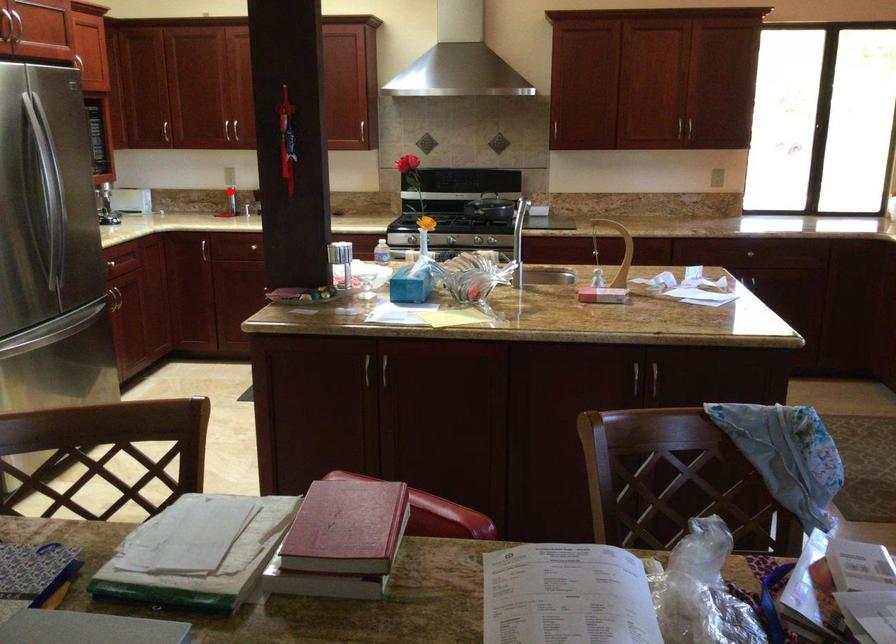
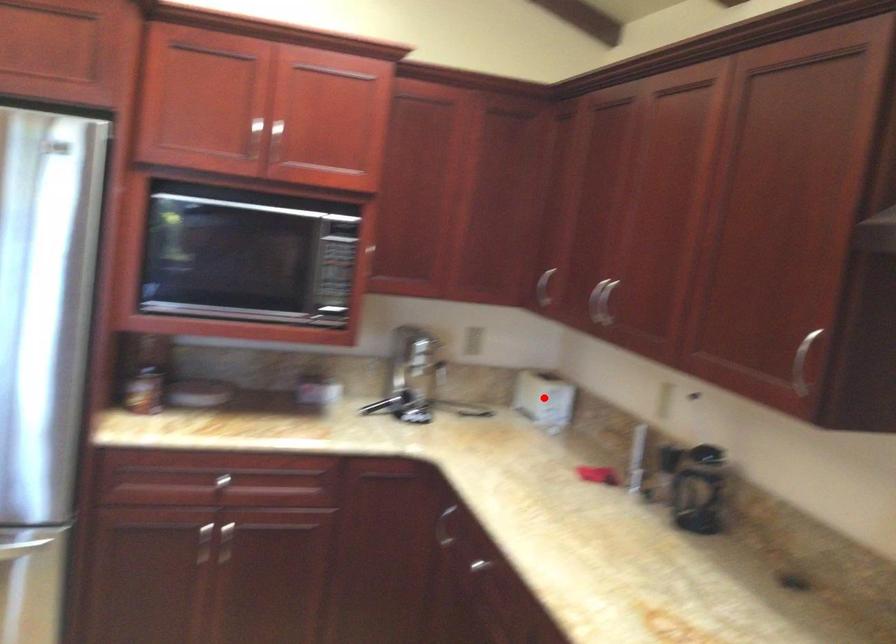
I am providing you with two images of the same scene from different viewpoints. A red point is marked on the first image and another point is marked on the second image. Is the marked point in image1 the same physical position as the marked point in image2?

No